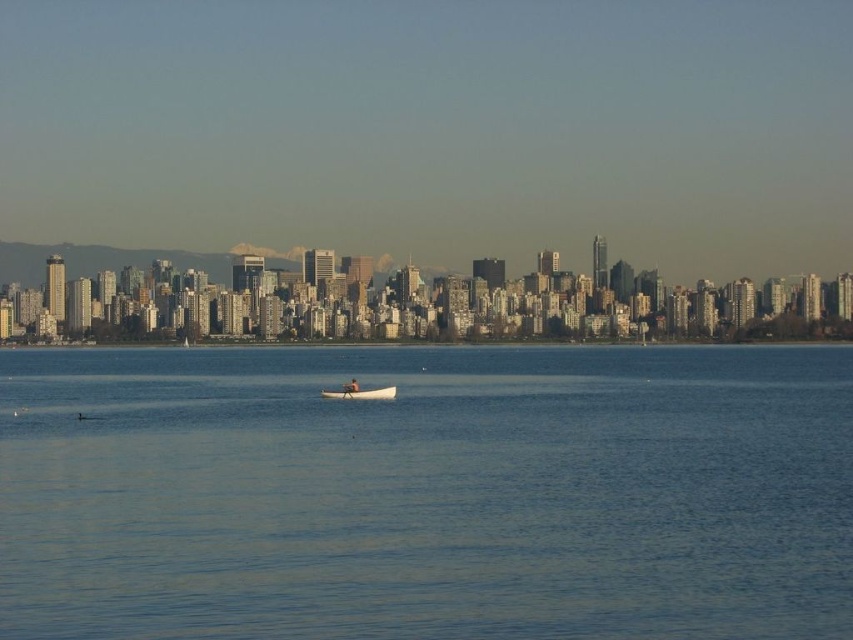
You are standing on the shore of the waterfront scene and want to take a photo of both the clear blue water at center and the white wood boat at center. Which object will appear larger in your photo?

The clear blue water at center will appear larger in the photo because it is closer to the viewer than the white wood boat at center.

You are standing on a dock and see the clear blue water at center and the white wood boat at center. You want to throw a stone into the water so that it lands as far as possible from the boat. What is the maximum distance you can achieve?

The maximum distance you can achieve is 53.18 meters by throwing the stone into the clear blue water at center, as it is located 53.18 meters away from the white wood boat at center.

You are a photographer planning to capture the city skyline in the background of your shot. You notice a point marked at coordinates (426, 493) on your camera screen. What is located at this point?

The point at coordinates (426, 493) marks clear blue water at center.